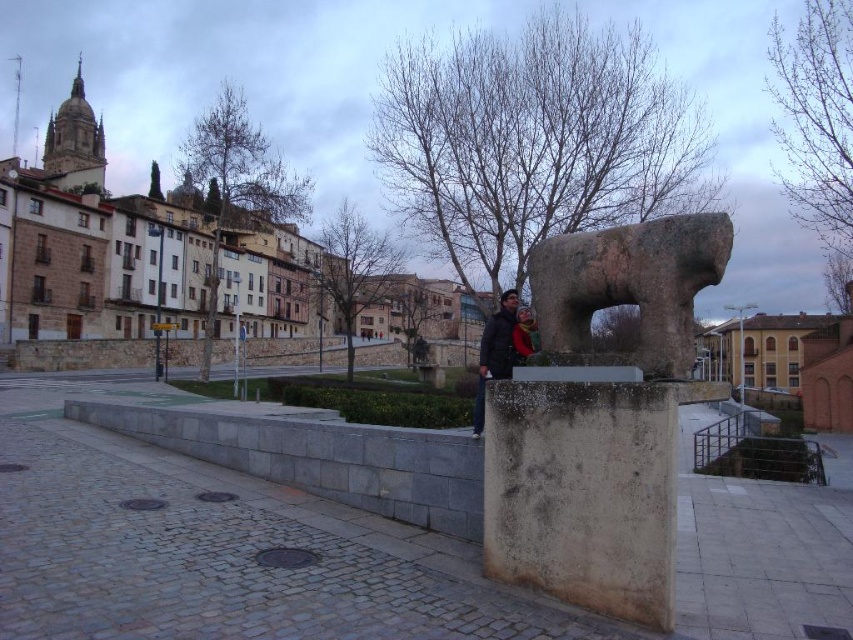
Does gray stone sculpture at center appear over yellow wool scarf at center?

No.

Between point (648, 554) and point (520, 358), which one is positioned in front?

Point (648, 554) is in front.

Image resolution: width=853 pixels, height=640 pixels. In order to click on gray stone sculpture at center in this screenshot , I will do `click(601, 419)`.

Is point (547, 636) behind point (612, 576)?

That is False.

Between point (791, 525) and point (659, 333), which one is positioned in front?

Positioned in front is point (659, 333).

At what (x,y) coordinates should I click in order to perform the action: click on smooth concrete block at center. Please return your answer as a coordinate pair (x, y). Looking at the image, I should click on (347, 552).

Can you confirm if rustic stone bull at center is thinner than yellow wool scarf at center?

No, rustic stone bull at center is not thinner than yellow wool scarf at center.

Between point (563, 308) and point (529, 339), which one is positioned behind?

Point (529, 339)

You are a GUI agent. You are given a task and a screenshot of the screen. Output one action in this format:
    pyautogui.click(x=<x>, y=<y>)
    Task: Click on the rustic stone bull at center
    The width and height of the screenshot is (853, 640).
    Given the screenshot: What is the action you would take?
    pyautogui.click(x=628, y=288)